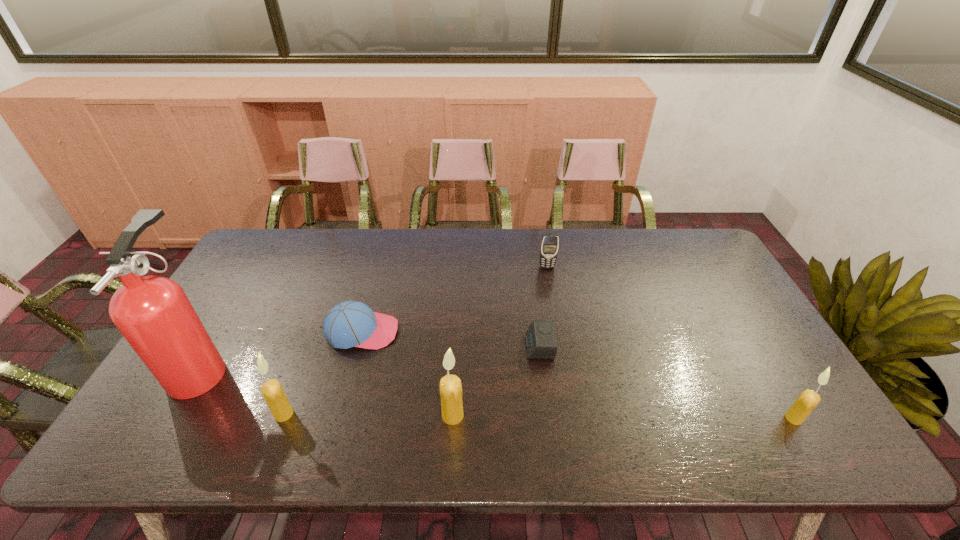
Find the location of a particular element. the sixth object from right to left is located at coordinates (272, 391).

Where is `the fifth shortest object`? the fifth shortest object is located at coordinates (272, 391).

The image size is (960, 540). I want to click on the second candle from right to left, so click(450, 385).

This screenshot has height=540, width=960. I want to click on the fourth tallest object, so click(x=807, y=401).

At what (x,y) coordinates should I click in order to perform the action: click on the rightmost candle. Please return your answer as a coordinate pair (x, y). Looking at the image, I should click on (807, 401).

Find the location of a particular element. cellular telephone is located at coordinates (549, 245).

You are a GUI agent. You are given a task and a screenshot of the screen. Output one action in this format:
    pyautogui.click(x=<x>, y=<y>)
    Task: Click on the fifth tallest object
    
    Given the screenshot: What is the action you would take?
    pyautogui.click(x=549, y=245)

Where is `the second shortest object`? This screenshot has height=540, width=960. the second shortest object is located at coordinates (349, 324).

Identify the location of baseball cap. (349, 324).

The width and height of the screenshot is (960, 540). I want to click on the leftmost object, so [153, 313].